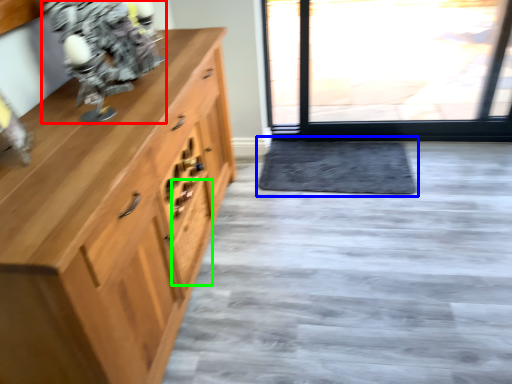
Question: Estimate the real-world distances between objects in this image. Which object is closer to figurine (highlighted by a red box), doormat (highlighted by a blue box) or drawer (highlighted by a green box)?

Choices:
 (A) doormat
 (B) drawer

Answer: (B)